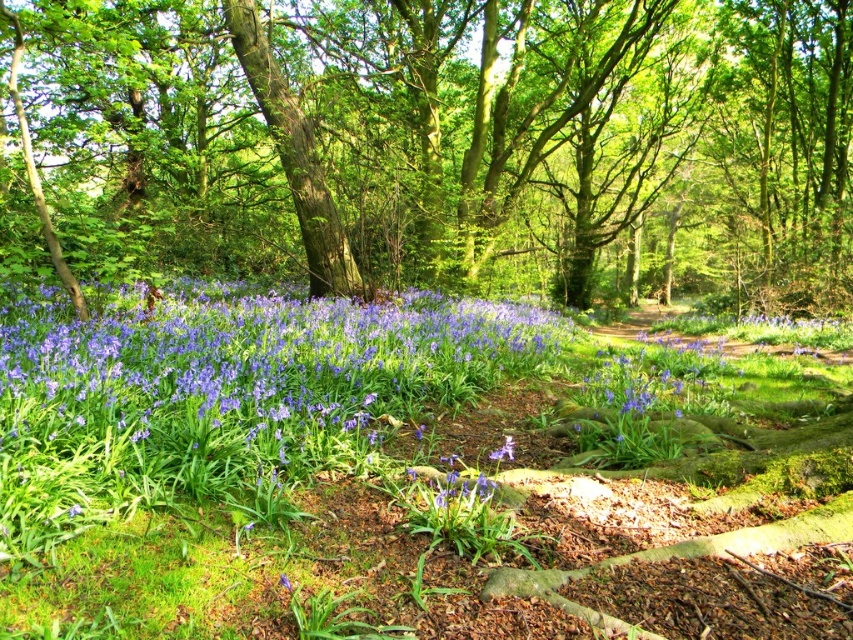
Does green leafy tree at center appear on the left side of purple glossy flowers at lower left?

No, green leafy tree at center is not to the left of purple glossy flowers at lower left.

You are a GUI agent. You are given a task and a screenshot of the screen. Output one action in this format:
    pyautogui.click(x=<x>, y=<y>)
    Task: Click on the green leafy tree at center
    Image resolution: width=853 pixels, height=640 pixels.
    Given the screenshot: What is the action you would take?
    pyautogui.click(x=434, y=145)

The height and width of the screenshot is (640, 853). What are the coordinates of `green leafy tree at center` in the screenshot? It's located at (434, 145).

Does point (337, 17) lie in front of point (286, 582)?

That is False.

Is green leafy tree at center further to camera compared to blue matte flower at center?

Yes.

Between point (454, 74) and point (279, 573), which one is positioned in front?

Positioned in front is point (279, 573).

Find the location of `green leafy tree at center`. green leafy tree at center is located at coordinates tap(434, 145).

Identify the location of purple glossy flowers at lower left. (264, 360).

Which is above, purple glossy flowers at lower left or blue matte flower at center?

purple glossy flowers at lower left is higher up.

Which is behind, point (329, 422) or point (286, 584)?

Positioned behind is point (329, 422).

Where is `purple glossy flowers at lower left`? The width and height of the screenshot is (853, 640). purple glossy flowers at lower left is located at coordinates (264, 360).